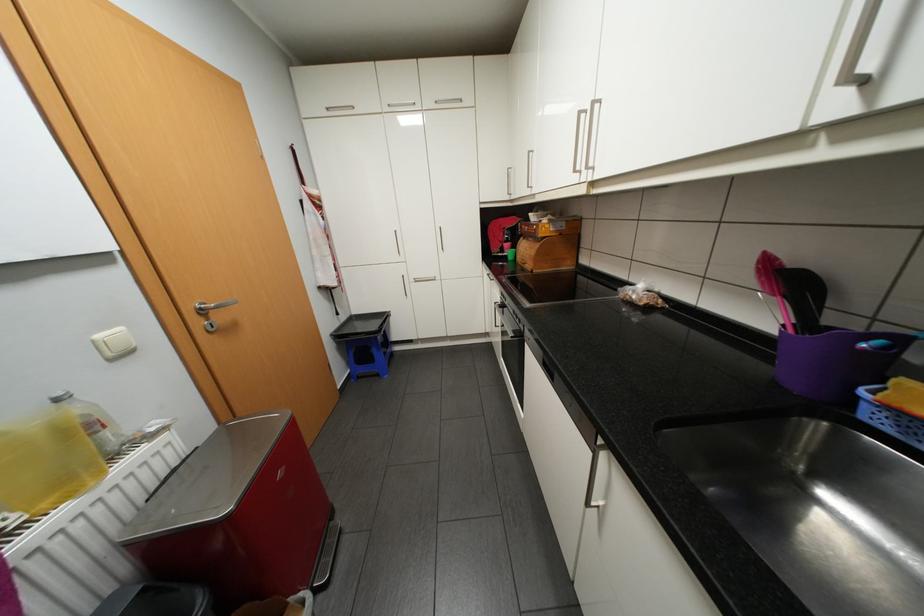
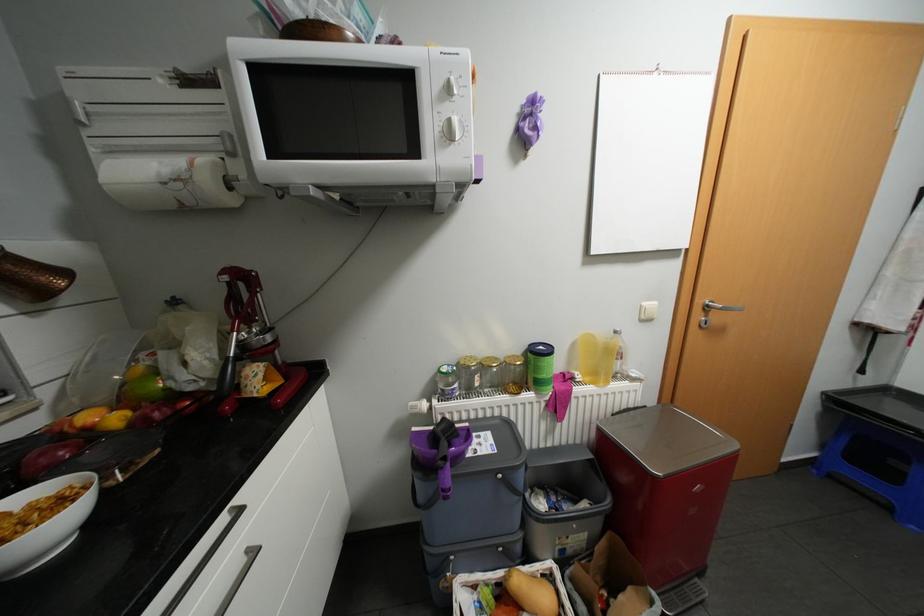
In the second image, find the point that corresponds to [209,308] in the first image.

(715, 305)